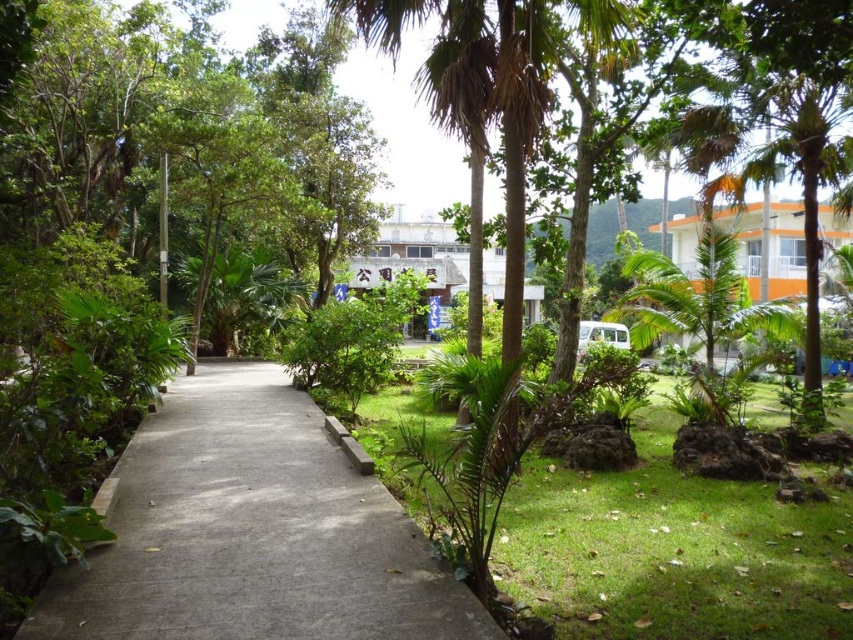
Based on the photo, you are standing at the entrance of the park and see the green leafy palm tree at center. If you walk straight along the path, will the palm tree stay in your line of sight?

The green leafy palm tree at center is located at point [476,100], which is along the central axis of the path. Therefore, walking straight along the path will keep the palm tree in your line of sight as you move forward.